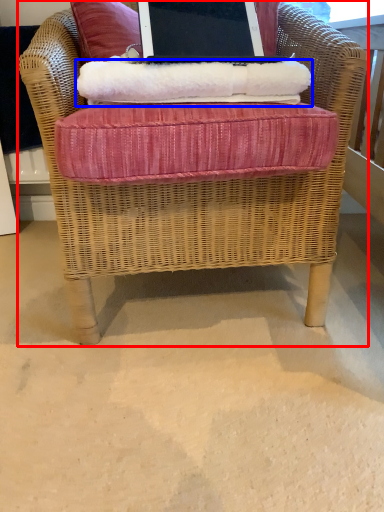
Question: Among these objects, which one is nearest to the camera, chair (highlighted by a red box) or material (highlighted by a blue box)?

Choices:
 (A) chair
 (B) material

Answer: (A)